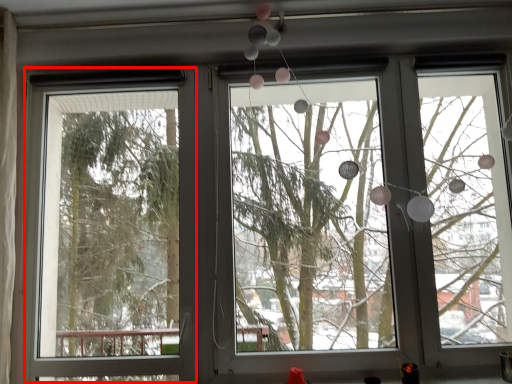
Question: In this image, where is screen door (annotated by the red box) located relative to bay window?

Choices:
 (A) right
 (B) left

Answer: (B)